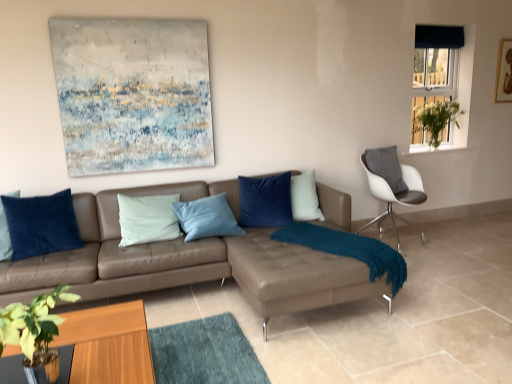
Where is `unoccupied area behind green leafy plant at lower left`? unoccupied area behind green leafy plant at lower left is located at coordinates (96, 346).